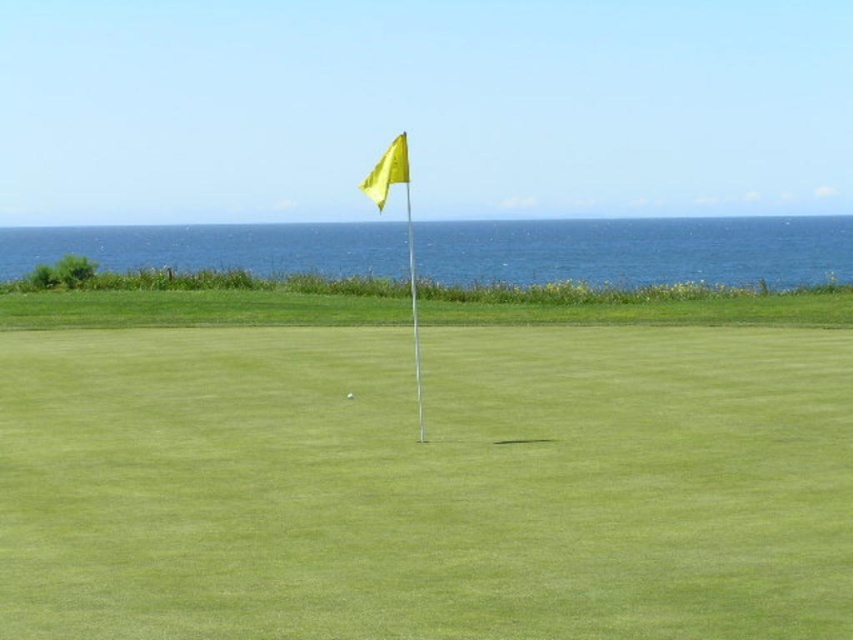
You are a golfer standing on the green putting surface. You see the yellow fabric flag at center and the blue water at upper center. Which object is closer to the horizon?

The blue water at upper center is closer to the horizon because it is positioned above the yellow fabric flag at center, suggesting it is farther away in the background.

You are a golfer standing at the edge of the green putting surface. You want to hit the golf ball into the hole marked by the yellow fabric flag at center. After the ball rolls into the hole, where will it end up relative to the blue water at upper center?

The yellow fabric flag at center is 120.20 meters away from the blue water at upper center. Since the ball goes into the hole, it will be at the location of the yellow fabric flag at center, which is 120.20 meters away from the blue water at upper center.

You are a golfer standing at the point with coordinates point [350,396]. You want to putt the ball towards the hole located at point [722,406]. Since you can see the flag, which is at the hole, will the flag be in your line of sight when aiming directly at the hole?

Yes, the flag at point [722,406] will be in your line of sight because point [722,406] is in front of point [350,396], meaning the hole is directly ahead along the path from your current position.